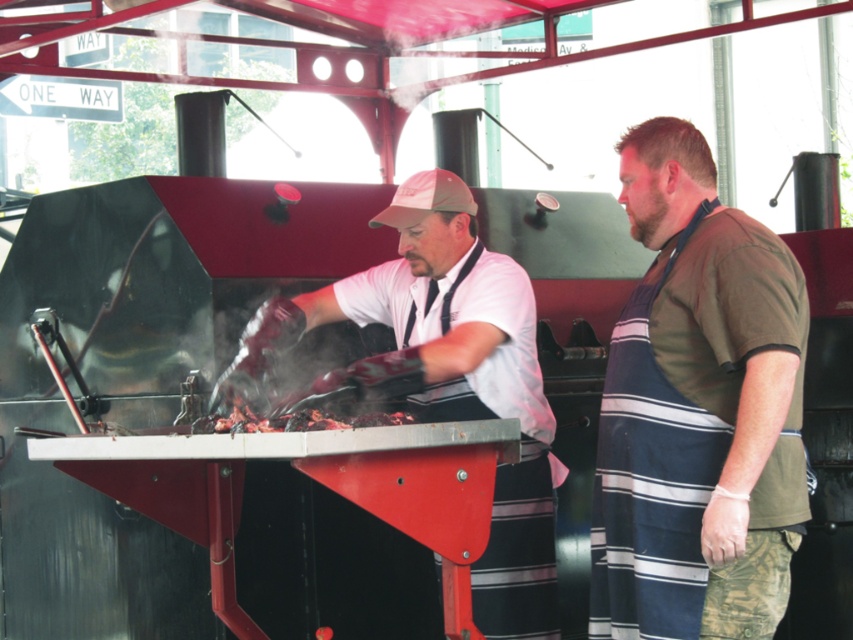
Is striped apron at right to the left of matte white shirt at center from the viewer's perspective?

Incorrect, striped apron at right is not on the left side of matte white shirt at center.

Is striped apron at right behind matte white shirt at center?

No, it is in front of matte white shirt at center.

You are a GUI agent. You are given a task and a screenshot of the screen. Output one action in this format:
    pyautogui.click(x=<x>, y=<y>)
    Task: Click on the striped apron at right
    
    Given the screenshot: What is the action you would take?
    [697, 410]

Locate an element on the screen. The image size is (853, 640). striped apron at right is located at coordinates (697, 410).

Can you confirm if striped apron at right is taller than charcoal-grilled meat at center?

Yes.

What are the coordinates of `striped apron at right` in the screenshot? It's located at (697, 410).

Image resolution: width=853 pixels, height=640 pixels. In order to click on striped apron at right in this screenshot , I will do `click(697, 410)`.

Can you confirm if matte white shirt at center is taller than charcoal-grilled meat at center?

Correct, matte white shirt at center is much taller as charcoal-grilled meat at center.

Who is lower down, matte white shirt at center or charcoal-grilled meat at center?

matte white shirt at center

Is point (521, 566) closer to viewer compared to point (387, 424)?

No, it is behind (387, 424).

Image resolution: width=853 pixels, height=640 pixels. Identify the location of matte white shirt at center. (468, 378).